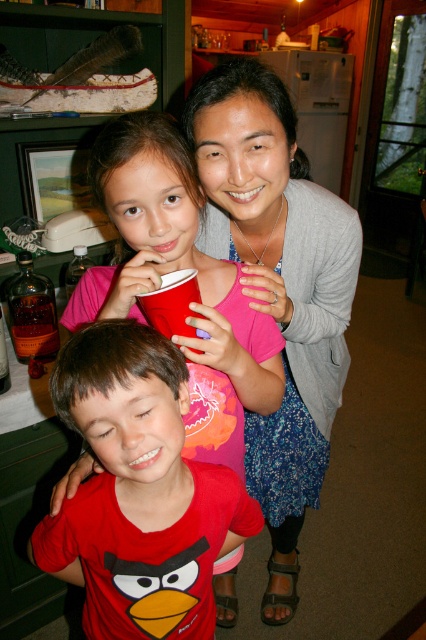
You are organizing a small party and need to arrange the gray knit sweater at upper center and the brown glass bottle at lower left on a shelf. If you want to place them side by side without overlapping, which object should be placed on the left side of the shelf?

The brown glass bottle at lower left should be placed on the left side of the shelf since the gray knit sweater at upper center is to the right of it in the original image.

You are a photographer adjusting the camera focus. The gray knit sweater at upper center and the red matte angry bird shirt at lower left are both in the frame. Which object should you focus on first if you want to ensure the larger one is sharp?

The gray knit sweater at upper center is larger in size than the red matte angry bird shirt at lower left, so you should focus on the gray knit sweater at upper center first to ensure it is sharp.

You are a photographer setting up for a family photo. You have a red matte angry bird shirt at lower left and a brown glass bottle at lower left in the scene. The minimum safe distance to prevent reflections from the bottle affecting the shirt is 30 inches. Will you need to adjust the positions of these items?

The red matte angry bird shirt at lower left is 28.67 inches from the brown glass bottle at lower left. Since the distance is less than the required 30 inches, you will need to adjust their positions to ensure the bottle doesn